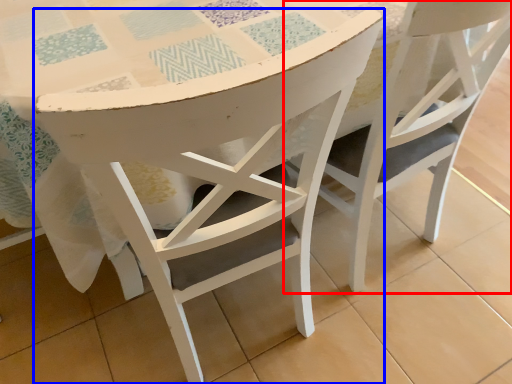
Question: Which of the following is the closest to the observer, chair (highlighted by a red box) or chair (highlighted by a blue box)?

Choices:
 (A) chair
 (B) chair

Answer: (B)